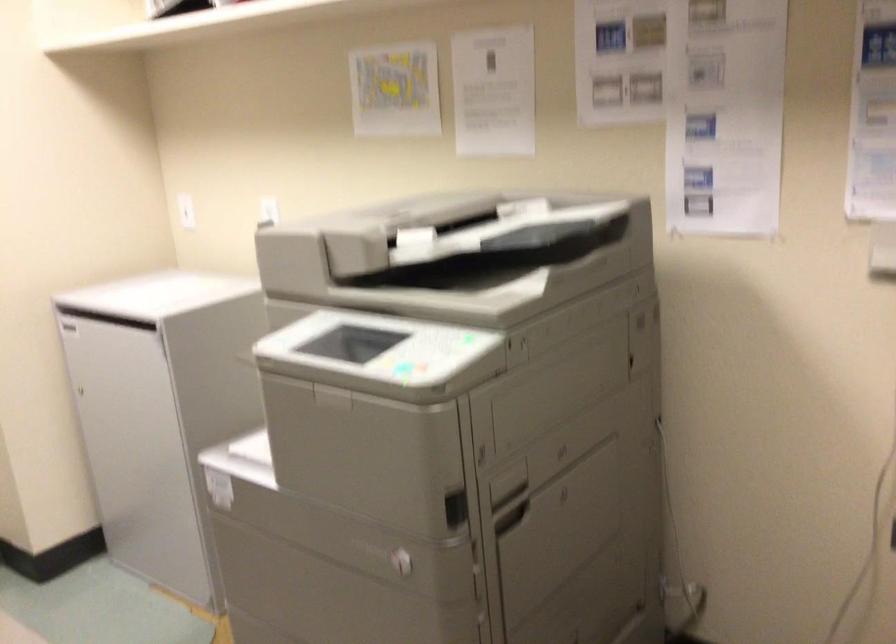
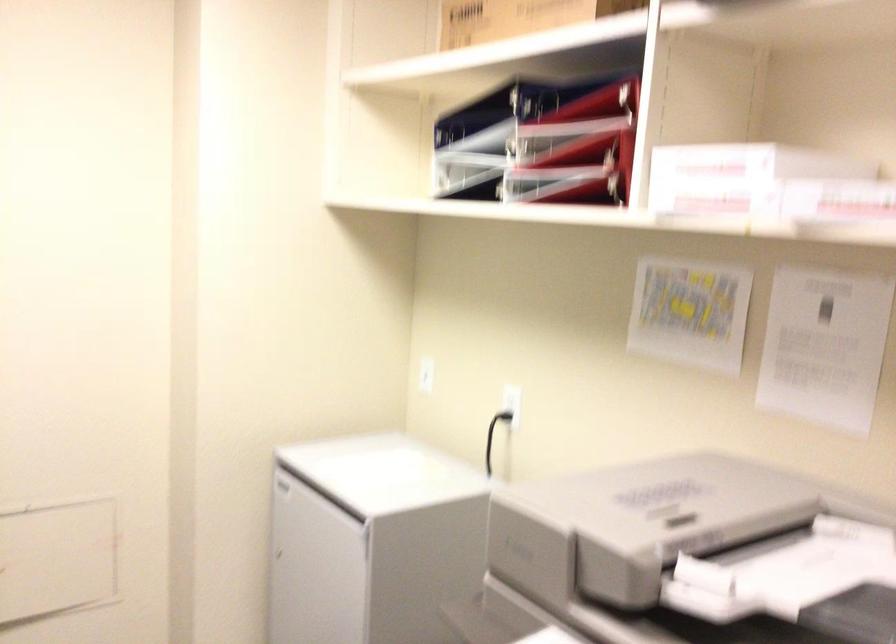
Question: The camera is either moving clockwise (left) or counter-clockwise (right) around the object. The first image is from the beginning of the video and the second image is from the end. Is the camera moving left or right when shooting the video?

Choices:
 (A) Left
 (B) Right

Answer: (B)